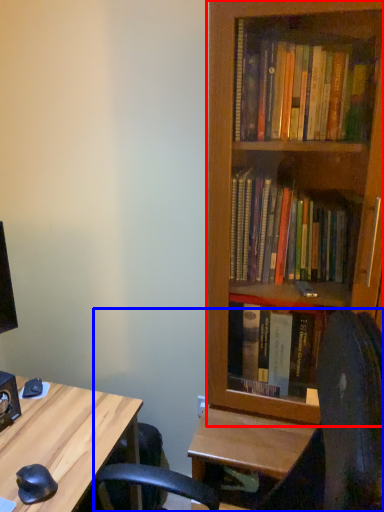
Question: Which of the following is the farthest to the observer, bookcase (highlighted by a red box) or computer chair (highlighted by a blue box)?

Choices:
 (A) bookcase
 (B) computer chair

Answer: (A)